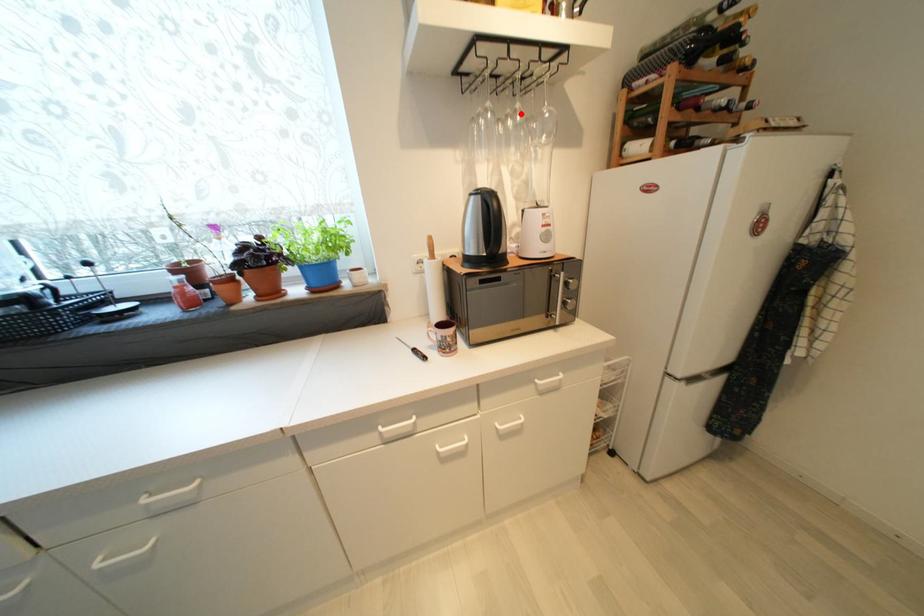
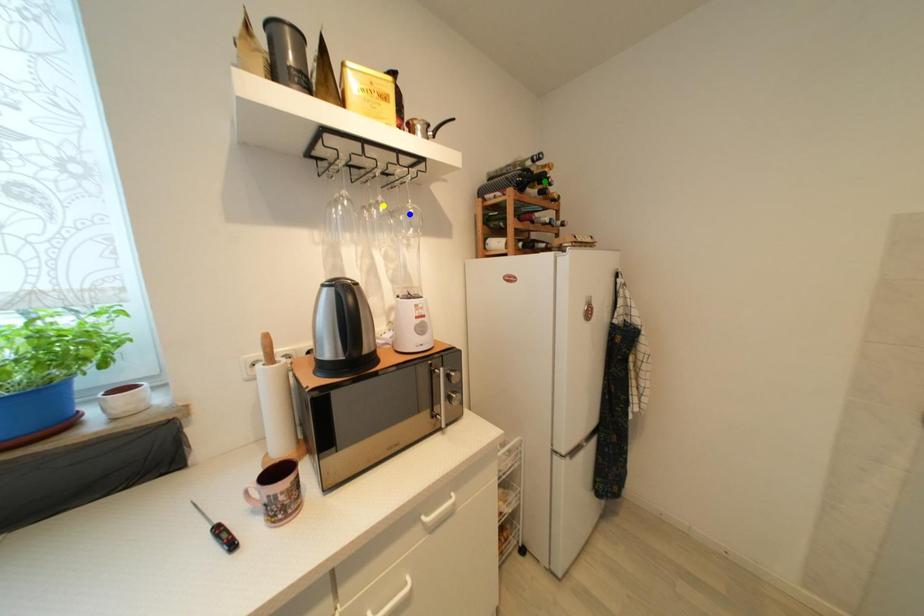
Question: I am providing you with two images of the same scene from different viewpoints. A red point is marked on the first image. You are given multiple points on the second image. Which point in image 2 represents the same 3d spot as the red point in image 1?

Choices:
 (A) blue point
 (B) yellow point
 (C) green point

Answer: (B)